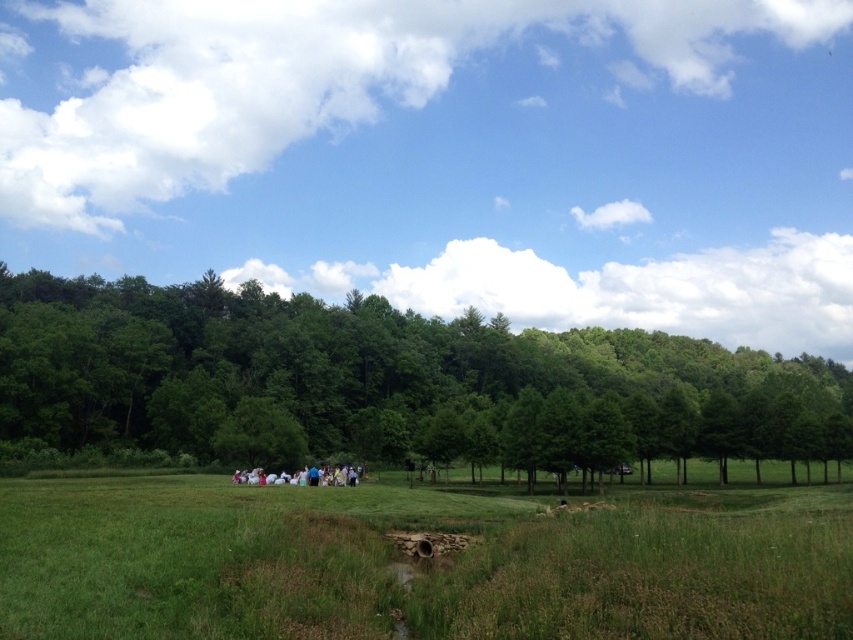
Question: Is the position of green grassy field at center less distant than that of green leafy tree at center?

Choices:
 (A) yes
 (B) no

Answer: (A)

Question: Does green leafy tree at center appear on the left side of white cotton dress at center?

Choices:
 (A) no
 (B) yes

Answer: (A)

Question: Which point appears closest to the camera in this image?

Choices:
 (A) (258, 483)
 (B) (595, 509)
 (C) (57, 419)

Answer: (B)

Question: Which point is farther from the camera taking this photo?

Choices:
 (A) (440, 451)
 (B) (556, 532)
 (C) (345, 476)

Answer: (A)

Question: Can you confirm if green grassy field at center is positioned to the right of green leafy tree at center?

Choices:
 (A) yes
 (B) no

Answer: (B)

Question: Which point is closer to the camera?

Choices:
 (A) green grassy field at center
 (B) white cotton dress at center
 (C) green leafy tree at center

Answer: (A)